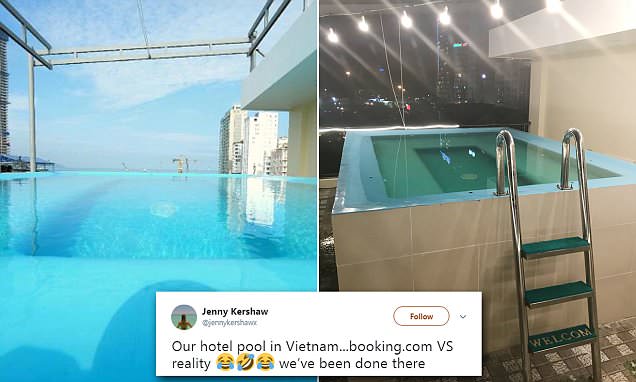
Where is `lights`? Image resolution: width=636 pixels, height=382 pixels. lights is located at coordinates (497, 15).